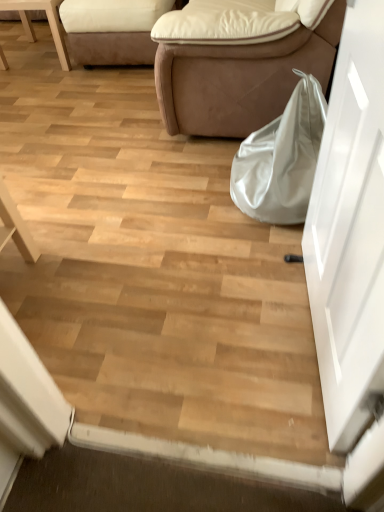
This screenshot has height=512, width=384. Identify the location of vacant space in between white leather chair at upper left and white glossy door at right. (149, 166).